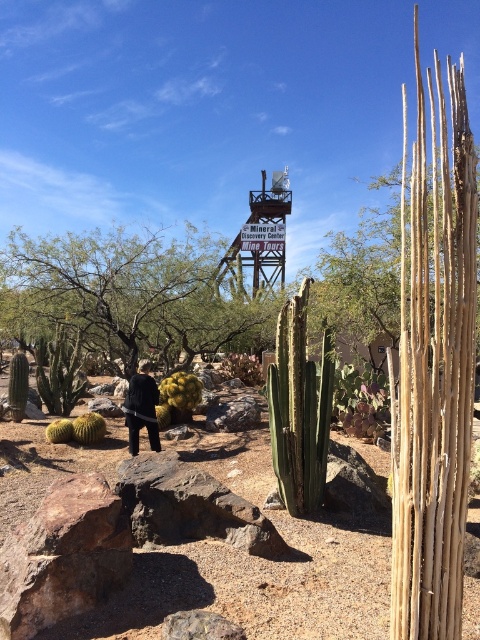
Question: Which point appears farthest from the camera in this image?

Choices:
 (A) (54, 436)
 (B) (105, 424)
 (C) (136, 396)

Answer: (B)

Question: Is black matte jacket at center further to the viewer compared to green fuzzy cactus at lower left?

Choices:
 (A) yes
 (B) no

Answer: (B)

Question: Does black matte jacket at center appear on the left side of green fuzzy cactus at lower left?

Choices:
 (A) yes
 (B) no

Answer: (B)

Question: Which point is farther to the camera?

Choices:
 (A) (51, 422)
 (B) (96, 442)

Answer: (A)

Question: Is green spiny cactus at lower left thinner than green fuzzy cactus at lower left?

Choices:
 (A) yes
 (B) no

Answer: (B)

Question: Which point is farther from the camera taking this photo?

Choices:
 (A) (90, 428)
 (B) (153, 428)
 (C) (66, 440)

Answer: (A)